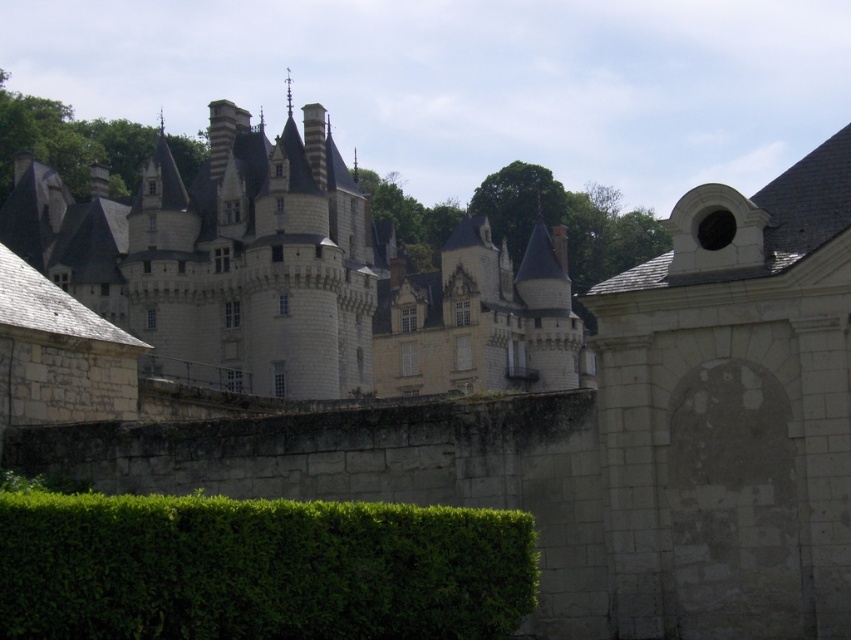
This screenshot has height=640, width=851. What do you see at coordinates (295, 275) in the screenshot?
I see `white stone castle at center` at bounding box center [295, 275].

Who is lower down, white stone castle at center or green leafy hedge at lower left?

green leafy hedge at lower left

Does point (495, 337) come closer to viewer compared to point (317, 595)?

No, (495, 337) is behind (317, 595).

The height and width of the screenshot is (640, 851). I want to click on white stone castle at center, so click(x=295, y=275).